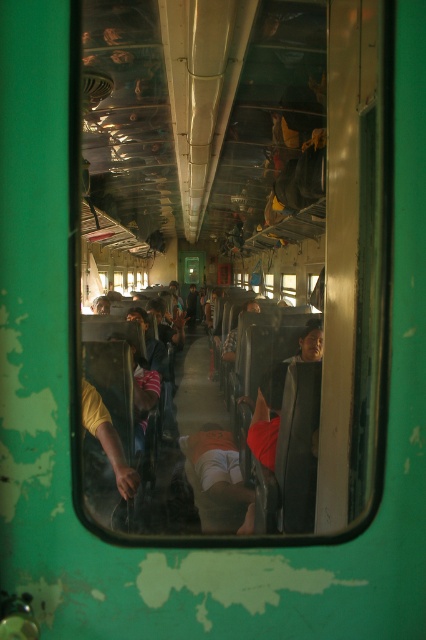
You are standing in front of the train carriage window. Where is the transparent glass window at center located in terms of coordinates?

The transparent glass window at center is located at coordinates point (287, 289).

You are standing outside the train carriage looking through the green window frame. There are two points marked on the window at coordinates point (x=321, y=90) and point (x=187, y=320). Which point corresponds to a location closer to you?

Point (x=321, y=90) is closer to the camera than point (x=187, y=320), so the point at (x=321, y=90) is closer to you.